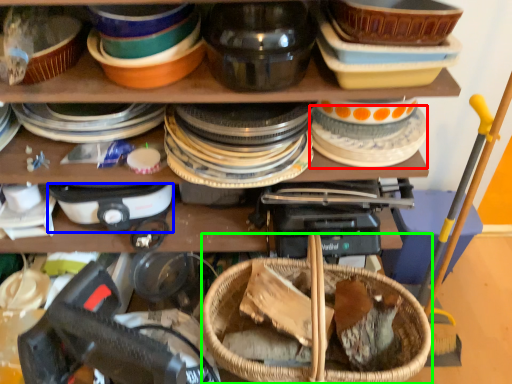
Question: Based on their relative distances, which object is nearer to tableware (highlighted by a red box)? Choose from appliance (highlighted by a blue box) and basket (highlighted by a green box).

Choices:
 (A) appliance
 (B) basket

Answer: (B)